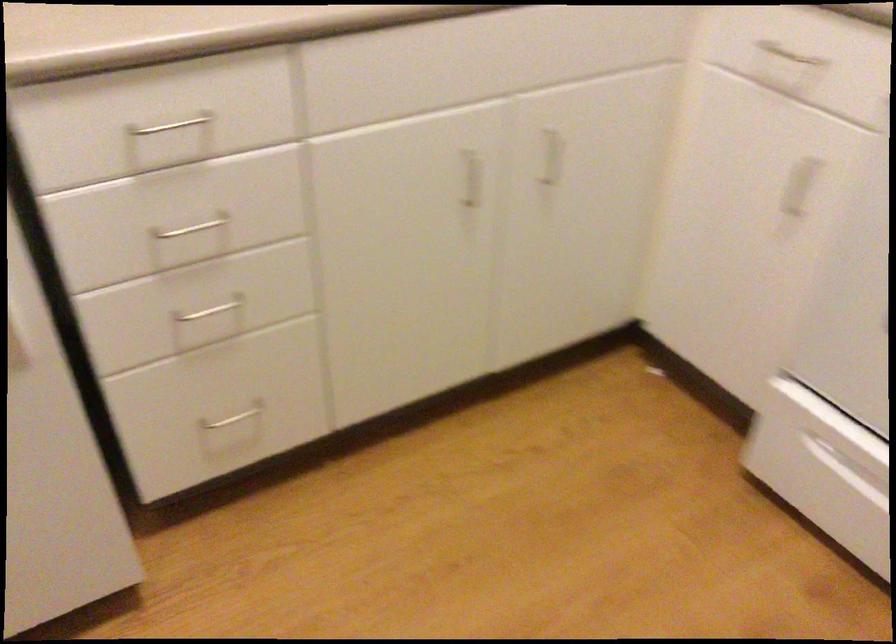
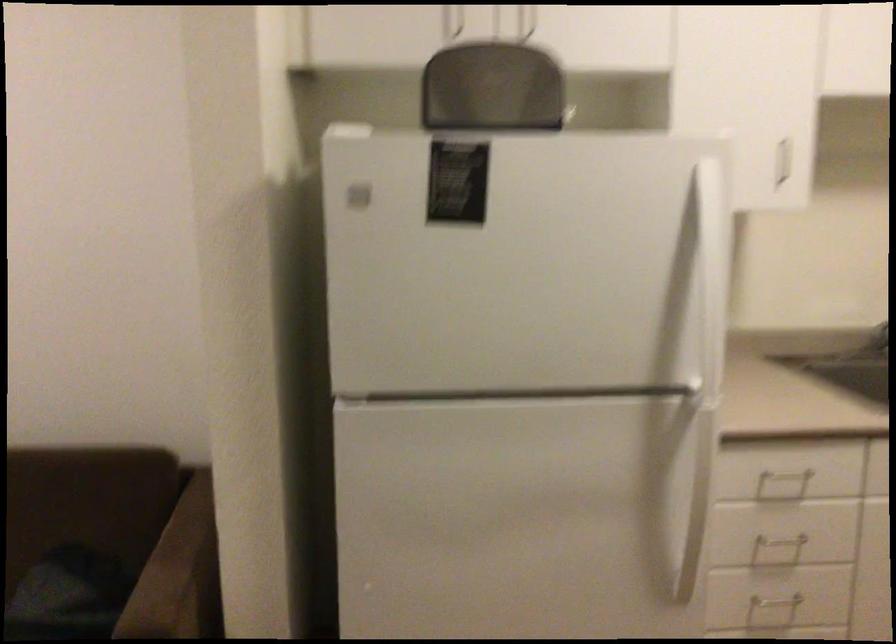
Where in the second image is the point corresponding to (214,310) from the first image?

(773, 608)